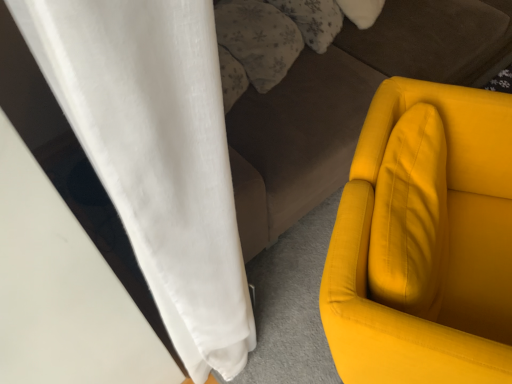
What do you see at coordinates (367, 244) in the screenshot? I see `matte yellow armchair at right` at bounding box center [367, 244].

The image size is (512, 384). What do you see at coordinates (313, 20) in the screenshot?
I see `fluffy white pillow at upper center, positioned as the first pillow in right-to-left order` at bounding box center [313, 20].

Where is `velvet brown studio couch at center`? The width and height of the screenshot is (512, 384). velvet brown studio couch at center is located at coordinates (348, 103).

How many degrees apart are the facing directions of matte yellow armchair at right and fluffy white pillow at upper center, positioned as the 2th pillow in right-to-left order?

8.5 degrees separate the facing orientations of matte yellow armchair at right and fluffy white pillow at upper center, positioned as the 2th pillow in right-to-left order.

Is matte yellow armchair at right oriented away from fluffy white pillow at upper center, the 1th pillow in the left-to-right sequence?

No, matte yellow armchair at right's orientation is not away from fluffy white pillow at upper center, the 1th pillow in the left-to-right sequence.

Which point is more distant from viewer, (498, 190) or (221, 44)?

Positioned behind is point (221, 44).

How distant is matte yellow armchair at right from fluffy white pillow at upper center, positioned as the 2th pillow in right-to-left order?

matte yellow armchair at right is 64.97 centimeters away from fluffy white pillow at upper center, positioned as the 2th pillow in right-to-left order.

From the image's perspective, is velvet brown studio couch at center located beneath fluffy white pillow at upper center, positioned as the first pillow in right-to-left order?

Incorrect, from the image's perspective, velvet brown studio couch at center is higher than fluffy white pillow at upper center, positioned as the first pillow in right-to-left order.

Is velvet brown studio couch at center far from fluffy white pillow at upper center, positioned as the first pillow in right-to-left order?

No, there isn't a large distance between velvet brown studio couch at center and fluffy white pillow at upper center, positioned as the first pillow in right-to-left order.

Which of these two, velvet brown studio couch at center or fluffy white pillow at upper center, positioned as the first pillow in right-to-left order, is bigger?

Bigger between the two is velvet brown studio couch at center.

Do you think velvet brown studio couch at center is within fluffy white pillow at upper center, positioned as the first pillow in right-to-left order, or outside of it?

velvet brown studio couch at center is not inside fluffy white pillow at upper center, positioned as the first pillow in right-to-left order, it's outside.

Is fluffy white pillow at upper center, positioned as the first pillow in right-to-left order, at the right side of fluffy white pillow at upper center, the 1th pillow in the left-to-right sequence?

Correct, you'll find fluffy white pillow at upper center, positioned as the first pillow in right-to-left order, to the right of fluffy white pillow at upper center, the 1th pillow in the left-to-right sequence.

Is fluffy white pillow at upper center, which is the second pillow in left-to-right order, with fluffy white pillow at upper center, positioned as the 2th pillow in right-to-left order?

No.

Is fluffy white pillow at upper center, which is the second pillow in left-to-right order, oriented away from fluffy white pillow at upper center, the 1th pillow in the left-to-right sequence?

No.

Which of these two, fluffy white pillow at upper center, which is the second pillow in left-to-right order, or fluffy white pillow at upper center, positioned as the 2th pillow in right-to-left order, is thinner?

fluffy white pillow at upper center, positioned as the 2th pillow in right-to-left order, is thinner.

Looking at their sizes, would you say fluffy white pillow at upper center, positioned as the first pillow in right-to-left order, is wider or thinner than matte yellow armchair at right?

Considering their sizes, fluffy white pillow at upper center, positioned as the first pillow in right-to-left order, looks slimmer than matte yellow armchair at right.

Does fluffy white pillow at upper center, which is the second pillow in left-to-right order, have a greater height compared to matte yellow armchair at right?

In fact, fluffy white pillow at upper center, which is the second pillow in left-to-right order, may be shorter than matte yellow armchair at right.

Is fluffy white pillow at upper center, positioned as the first pillow in right-to-left order, next to matte yellow armchair at right and touching it?

No, fluffy white pillow at upper center, positioned as the first pillow in right-to-left order, is not touching matte yellow armchair at right.

Considering the relative sizes of fluffy white pillow at upper center, which is the second pillow in left-to-right order, and matte yellow armchair at right in the image provided, is fluffy white pillow at upper center, which is the second pillow in left-to-right order, bigger than matte yellow armchair at right?

No.

Between point (283, 11) and point (276, 237), which one is positioned in front?

The point (283, 11) is closer to the camera.

Could you measure the distance between fluffy white pillow at upper center, which is the second pillow in left-to-right order, and velvet brown studio couch at center?

fluffy white pillow at upper center, which is the second pillow in left-to-right order, and velvet brown studio couch at center are 13.70 inches apart from each other.

Which of these two, fluffy white pillow at upper center, which is the second pillow in left-to-right order, or velvet brown studio couch at center, stands shorter?

fluffy white pillow at upper center, which is the second pillow in left-to-right order.

Between fluffy white pillow at upper center, which is the second pillow in left-to-right order, and velvet brown studio couch at center, which one has larger size?

With larger size is velvet brown studio couch at center.

Based on the photo, does matte yellow armchair at right come behind fluffy white pillow at upper center, positioned as the first pillow in right-to-left order?

No, it is not.

Is matte yellow armchair at right facing towards fluffy white pillow at upper center, positioned as the first pillow in right-to-left order?

No.

Which is more to the left, matte yellow armchair at right or fluffy white pillow at upper center, which is the second pillow in left-to-right order?

fluffy white pillow at upper center, which is the second pillow in left-to-right order.

From the image's perspective, would you say matte yellow armchair at right is positioned over fluffy white pillow at upper center, positioned as the first pillow in right-to-left order?

Incorrect, from the image's perspective, matte yellow armchair at right is lower than fluffy white pillow at upper center, positioned as the first pillow in right-to-left order.

Identify the location of studio couch that is in front of the fluffy white pillow at upper center, positioned as the 2th pillow in right-to-left order. This screenshot has height=384, width=512. (348, 103).

Does velvet brown studio couch at center appear on the left side of fluffy white pillow at upper center, positioned as the 2th pillow in right-to-left order?

No.

Looking at the image, does velvet brown studio couch at center seem bigger or smaller compared to fluffy white pillow at upper center, the 1th pillow in the left-to-right sequence?

In the image, velvet brown studio couch at center appears to be larger than fluffy white pillow at upper center, the 1th pillow in the left-to-right sequence.

In the image, is velvet brown studio couch at center positioned in front of or behind fluffy white pillow at upper center, positioned as the 2th pillow in right-to-left order?

Clearly, velvet brown studio couch at center is in front of fluffy white pillow at upper center, positioned as the 2th pillow in right-to-left order.

At what (x,y) coordinates should I click in order to perform the action: click on furniture below the fluffy white pillow at upper center, positioned as the 2th pillow in right-to-left order (from a real-world perspective). Please return your answer as a coordinate pair (x, y). The image size is (512, 384). Looking at the image, I should click on (367, 244).

Where is `studio couch located above the fluffy white pillow at upper center, which is the second pillow in left-to-right order (from the image's perspective)`? The width and height of the screenshot is (512, 384). studio couch located above the fluffy white pillow at upper center, which is the second pillow in left-to-right order (from the image's perspective) is located at coordinates (348, 103).

In the scene shown: From the image, which object appears to be nearer to fluffy white pillow at upper center, positioned as the 2th pillow in right-to-left order, matte yellow armchair at right or fluffy white pillow at upper center, positioned as the first pillow in right-to-left order?

Based on the image, fluffy white pillow at upper center, positioned as the first pillow in right-to-left order, appears to be nearer to fluffy white pillow at upper center, positioned as the 2th pillow in right-to-left order.

Considering their positions, is matte yellow armchair at right positioned closer to fluffy white pillow at upper center, positioned as the first pillow in right-to-left order, than fluffy white pillow at upper center, positioned as the 2th pillow in right-to-left order?

fluffy white pillow at upper center, positioned as the 2th pillow in right-to-left order, is closer to fluffy white pillow at upper center, positioned as the first pillow in right-to-left order.

From the image, which object appears to be nearer to fluffy white pillow at upper center, the 1th pillow in the left-to-right sequence, fluffy white pillow at upper center, positioned as the first pillow in right-to-left order, or matte yellow armchair at right?

fluffy white pillow at upper center, positioned as the first pillow in right-to-left order.

Considering their positions, is matte yellow armchair at right positioned further to fluffy white pillow at upper center, positioned as the first pillow in right-to-left order, than velvet brown studio couch at center?

matte yellow armchair at right.

Based on their spatial positions, is fluffy white pillow at upper center, positioned as the 2th pillow in right-to-left order, or matte yellow armchair at right further from velvet brown studio couch at center?

matte yellow armchair at right is positioned further to the anchor velvet brown studio couch at center.

Considering their positions, is fluffy white pillow at upper center, the 1th pillow in the left-to-right sequence, positioned closer to fluffy white pillow at upper center, positioned as the first pillow in right-to-left order, than matte yellow armchair at right?

fluffy white pillow at upper center, the 1th pillow in the left-to-right sequence, lies closer to fluffy white pillow at upper center, positioned as the first pillow in right-to-left order, than the other object.

Looking at the image, which one is located further to fluffy white pillow at upper center, positioned as the 2th pillow in right-to-left order, fluffy white pillow at upper center, positioned as the first pillow in right-to-left order, or velvet brown studio couch at center?

velvet brown studio couch at center is positioned further to the anchor fluffy white pillow at upper center, positioned as the 2th pillow in right-to-left order.

Considering their positions, is velvet brown studio couch at center positioned closer to matte yellow armchair at right than fluffy white pillow at upper center, positioned as the first pillow in right-to-left order?

velvet brown studio couch at center is closer to matte yellow armchair at right.

Where is `pillow between velvet brown studio couch at center and fluffy white pillow at upper center, positioned as the first pillow in right-to-left order, from front to back`? pillow between velvet brown studio couch at center and fluffy white pillow at upper center, positioned as the first pillow in right-to-left order, from front to back is located at coordinates (258, 39).

At what (x,y) coordinates should I click in order to perform the action: click on pillow between fluffy white pillow at upper center, which is the second pillow in left-to-right order, and matte yellow armchair at right vertically. Please return your answer as a coordinate pair (x, y). Looking at the image, I should click on (258, 39).